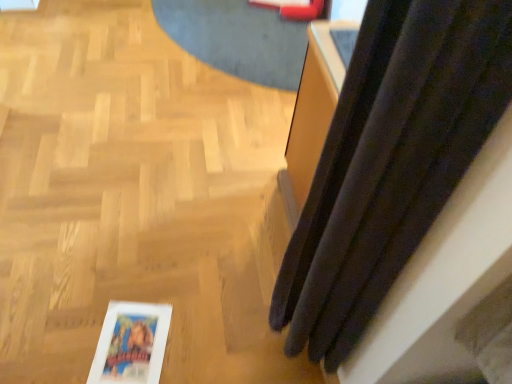
This screenshot has width=512, height=384. Identify the location of vacant area situated below white glossy magazine at lower left (from a real-world perspective). (131, 346).